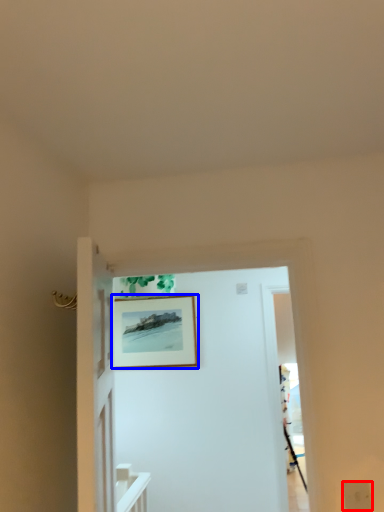
Question: Among these objects, which one is farthest to the camera, electric outlet (highlighted by a red box) or picture frame (highlighted by a blue box)?

Choices:
 (A) electric outlet
 (B) picture frame

Answer: (B)